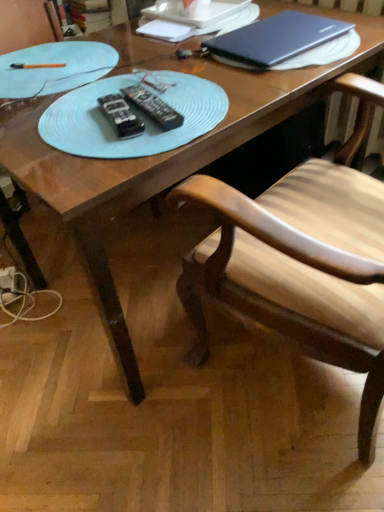
Image resolution: width=384 pixels, height=512 pixels. In order to click on vacant area that is in front of black plastic remote at center, positioned as the 2th remote in left-to-right order in this screenshot , I will do `click(129, 153)`.